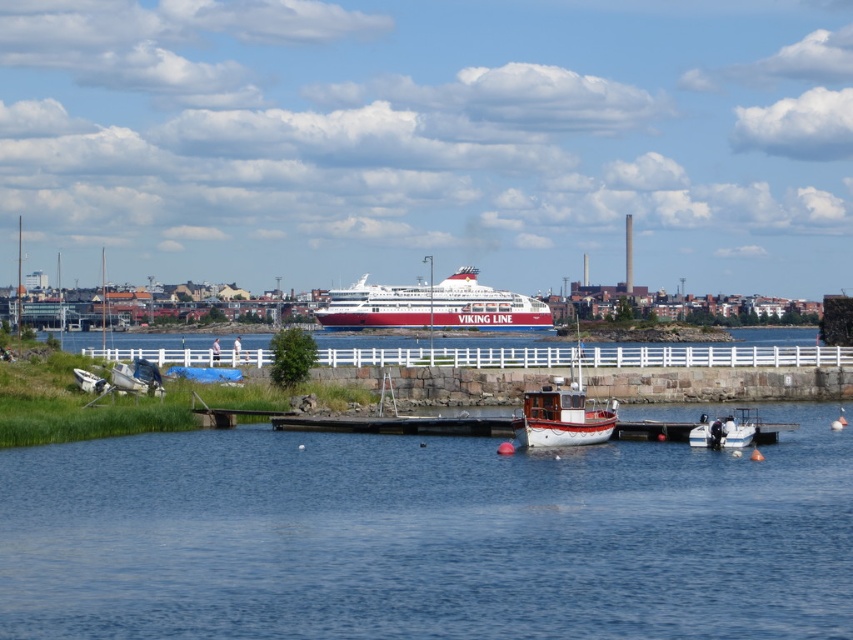
Is point (548, 404) positioned after point (752, 436)?

Yes, point (548, 404) is farther from viewer.

Find the location of a particular element. white matte boat at center is located at coordinates (561, 419).

What do you see at coordinates (426, 538) in the screenshot?
I see `blue water at center` at bounding box center [426, 538].

Between blue water at center and white matte boat at center, which one has less height?

blue water at center

Does point (601, 456) come behind point (560, 442)?

No, (601, 456) is in front of (560, 442).

Identify the location of blue water at center. [426, 538].

Does point (813, 445) come in front of point (735, 436)?

No.

Is blue water at center taller than white matte boat at lower right?

No.

Who is more distant from viewer, (643, 602) or (732, 436)?

The point (732, 436) is behind.

Find the location of a particular element. blue water at center is located at coordinates (426, 538).